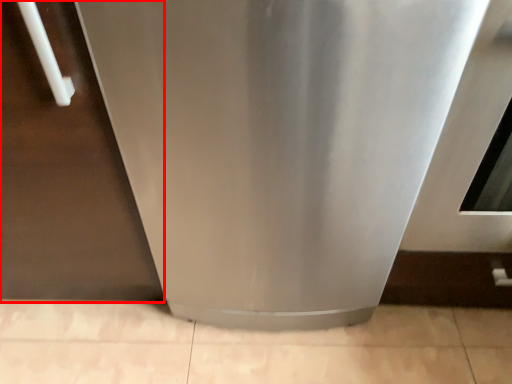
Question: From the image, what is the correct spatial relationship of door (annotated by the red box) in relation to home appliance?

Choices:
 (A) right
 (B) left

Answer: (B)